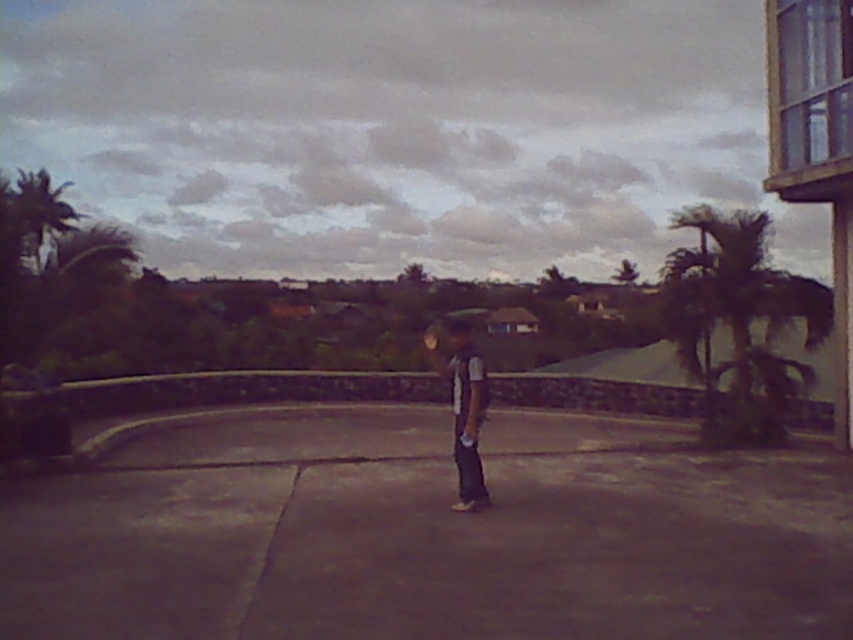
Who is lower down, green leafy palm tree at right or dark gray jeans at center?

dark gray jeans at center is lower down.

Describe the element at coordinates (738, 323) in the screenshot. I see `green leafy palm tree at right` at that location.

Is point (726, 365) positioned behind point (460, 337)?

Yes, it is.

Identify the location of green leafy palm tree at right. (738, 323).

Between dark gray jeans at center and green leafy palm tree at upper left, which one has more height?

green leafy palm tree at upper left

Find the location of a particular element. This screenshot has width=853, height=640. dark gray jeans at center is located at coordinates (463, 408).

The width and height of the screenshot is (853, 640). Identify the location of dark gray jeans at center. (463, 408).

Does green leafy palm tree at right appear on the right side of green leafy palm tree at upper left?

Yes, green leafy palm tree at right is to the right of green leafy palm tree at upper left.

Is point (735, 301) closer to camera compared to point (51, 208)?

That is True.

Where is `green leafy palm tree at right`? green leafy palm tree at right is located at coordinates (738, 323).